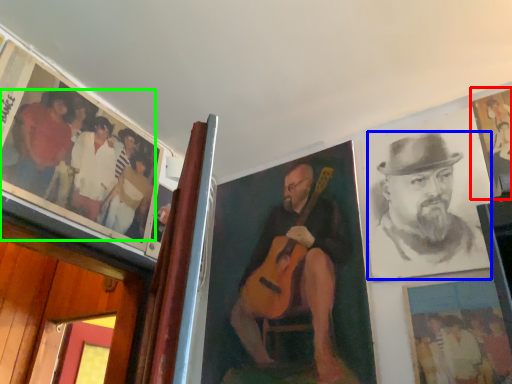
Question: Considering the real-world distances, which object is farthest from picture frame (highlighted by a red box)? man (highlighted by a blue box) or person (highlighted by a green box)?

Choices:
 (A) man
 (B) person

Answer: (B)